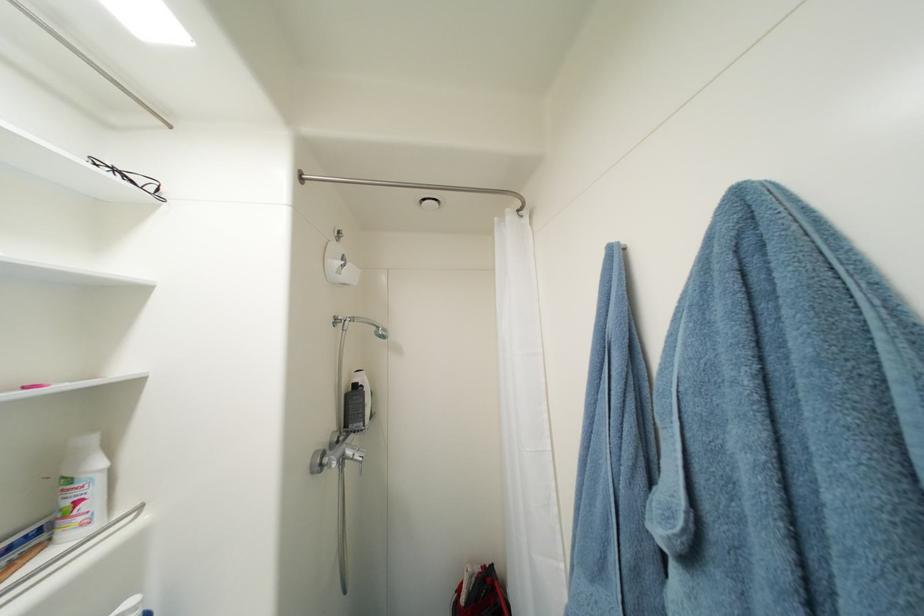
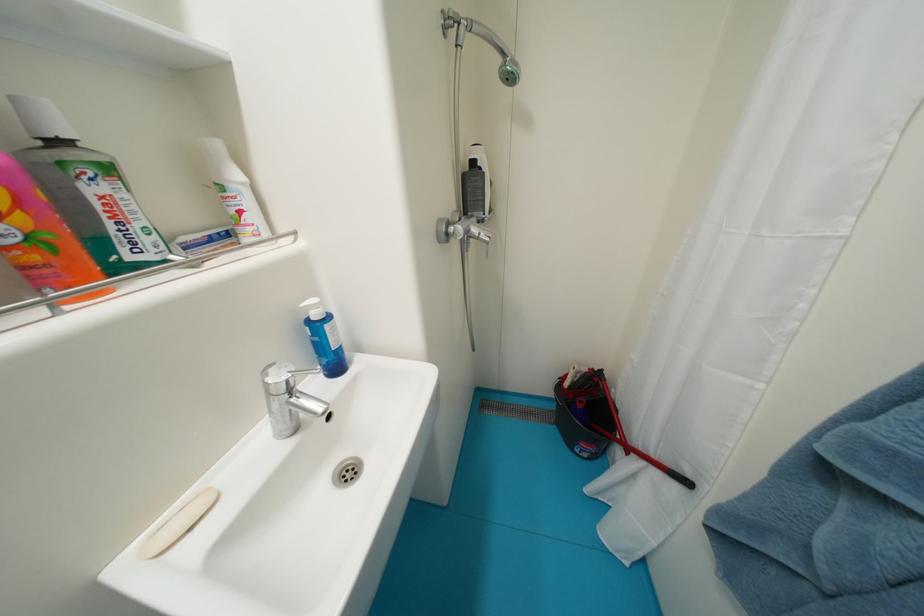
Based on the photo, the first image is from the beginning of the video and the second image is from the end. How did the camera likely rotate when shooting the video?

The camera's rotation is toward left-down.